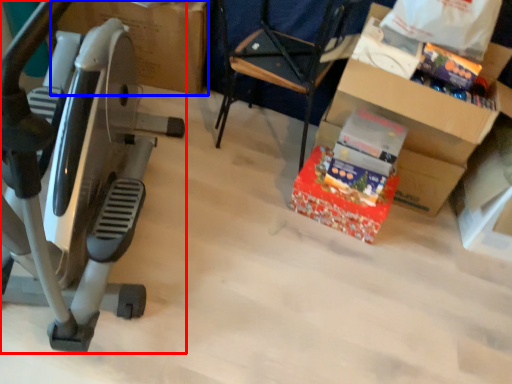
Question: Which object appears closest to the camera in this image, stationary bicycle (highlighted by a red box) or cardboard box (highlighted by a blue box)?

Choices:
 (A) stationary bicycle
 (B) cardboard box

Answer: (A)